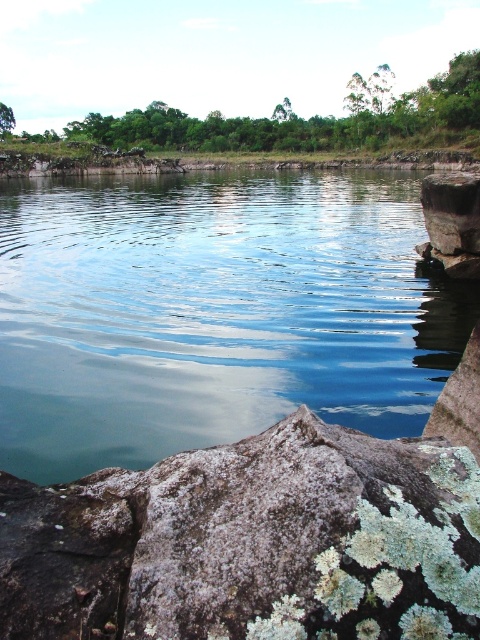
You are a GUI agent. You are given a task and a screenshot of the screen. Output one action in this format:
    pyautogui.click(x=<x>, y=<y>)
    Task: Click on the clear water at center
    Image resolution: width=480 pixels, height=640 pixels.
    Given the screenshot: What is the action you would take?
    pyautogui.click(x=214, y=312)

Which is in front, point (13, 381) or point (181, 500)?

Positioned in front is point (181, 500).

Does point (455, 326) come closer to viewer compared to point (392, 595)?

No, it is behind (392, 595).

This screenshot has width=480, height=640. Identify the location of clear water at center. (214, 312).